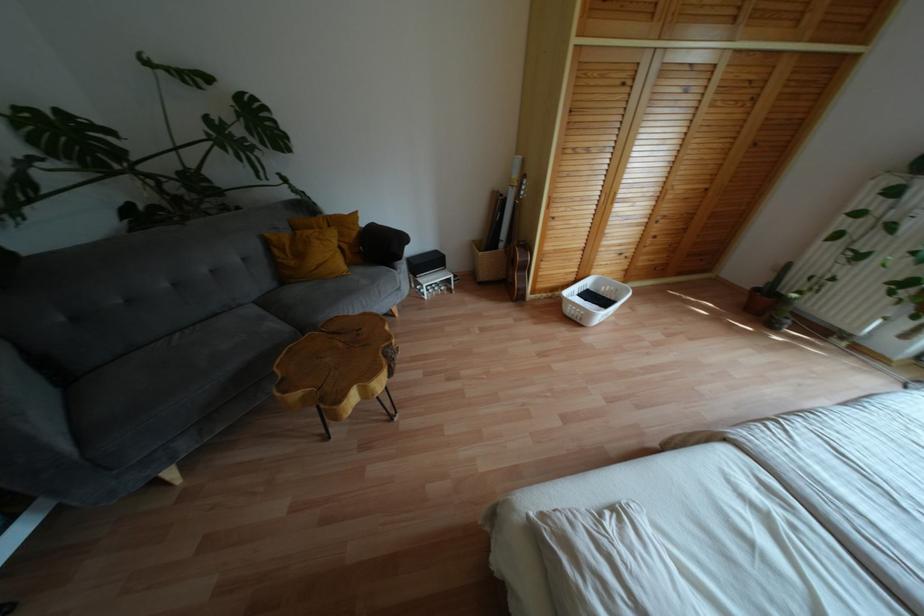
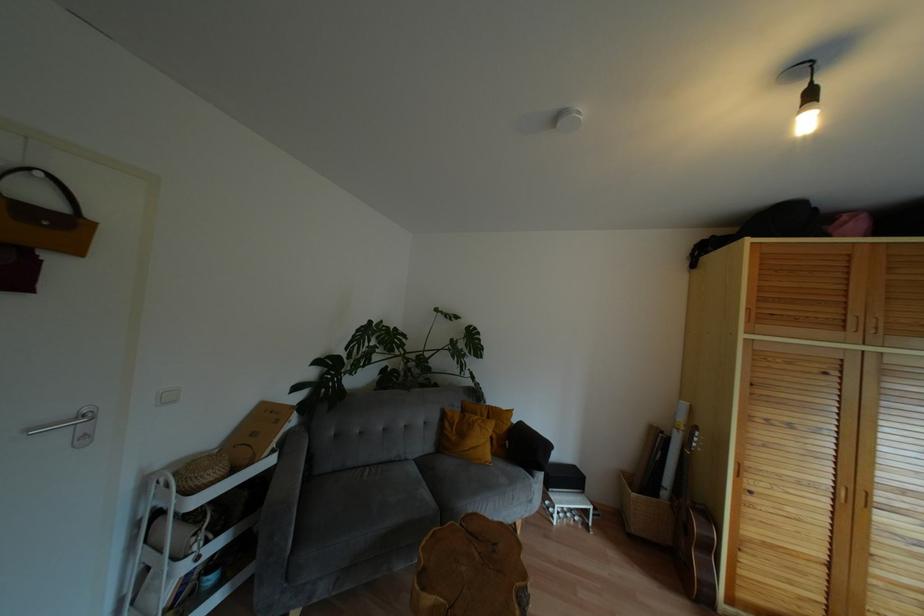
Find the pixel in the second image that matches the point at 525,267 in the first image.

(710, 548)